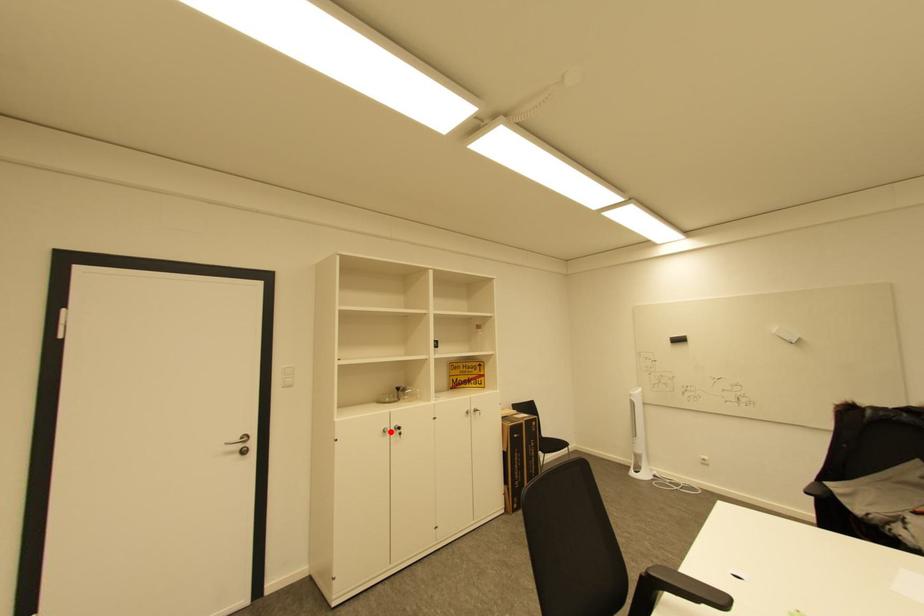
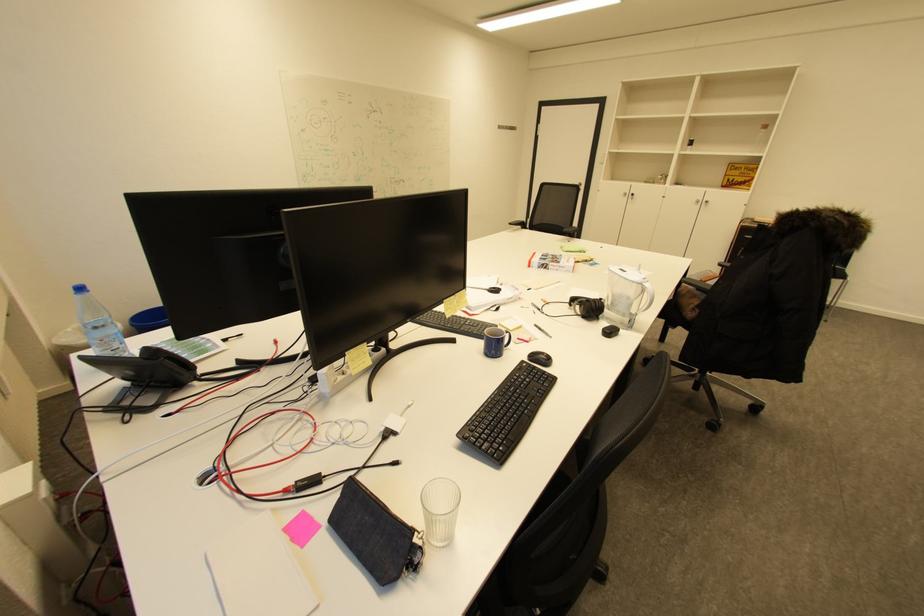
Question: A red point is marked in image1. In image2, is the corresponding 3D point closer to the camera or farther? Reply with the corresponding letter.

Choices:
 (A) The corresponding 3D point is closer.
 (B) The corresponding 3D point is farther.

Answer: (A)